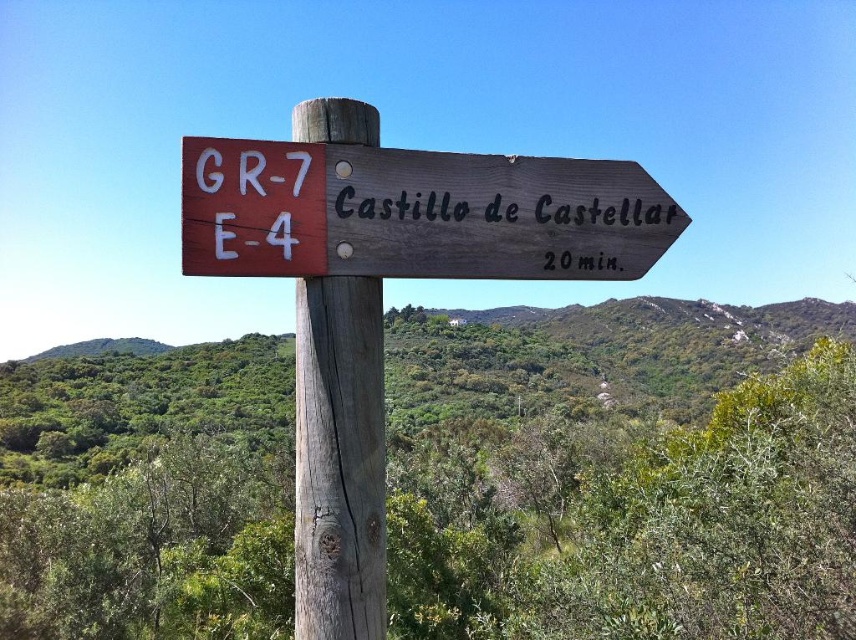
Question: Among these points, which one is nearest to the camera?

Choices:
 (A) (304, 404)
 (B) (642, 198)
 (C) (664, 218)

Answer: (A)

Question: Is wooden post at center wider than brown wooden sign at upper right?

Choices:
 (A) yes
 (B) no

Answer: (B)

Question: Estimate the real-world distances between objects in this image. Which object is closer to the wooden signpost at center?

Choices:
 (A) wooden post at center
 (B) brown wooden sign at upper right

Answer: (B)

Question: Does wooden signpost at center have a smaller size compared to brown wooden sign at upper right?

Choices:
 (A) no
 (B) yes

Answer: (A)

Question: Which of the following is the closest to the observer?

Choices:
 (A) (272, 163)
 (B) (377, 577)
 (C) (566, 218)

Answer: (A)

Question: Can you confirm if wooden signpost at center is positioned to the left of wooden post at center?

Choices:
 (A) yes
 (B) no

Answer: (B)